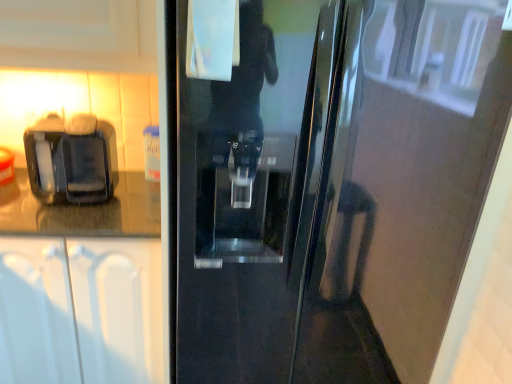
Locate an element on the screen. glossy black refrigerator at center is located at coordinates (329, 186).

Can you see white matte cabinet at left touching glossy black refrigerator at center?

white matte cabinet at left and glossy black refrigerator at center are clearly separated.

Would you say white matte cabinet at left contains glossy black refrigerator at center?

No.

Is white matte cabinet at left shorter than glossy black refrigerator at center?

Correct, white matte cabinet at left is not as tall as glossy black refrigerator at center.

Based on the photo, which is more to the right, white matte cabinet at left or glossy black refrigerator at center?

Positioned to the right is glossy black refrigerator at center.

Does black plastic coffee machine at left come behind white matte cabinet at left?

Yes, it is.

Considering the relative sizes of black plastic coffee machine at left and white matte cabinet at left in the image provided, is black plastic coffee machine at left wider than white matte cabinet at left?

No, black plastic coffee machine at left is not wider than white matte cabinet at left.

How distant is black plastic coffee machine at left from white matte cabinet at left?

black plastic coffee machine at left is 13.58 inches away from white matte cabinet at left.

Does glossy black refrigerator at center contain black plastic coffee machine at left?

No, black plastic coffee machine at left is not surrounded by glossy black refrigerator at center.

Which is in front, glossy black refrigerator at center or black plastic coffee machine at left?

glossy black refrigerator at center is more forward.

Which of these two, glossy black refrigerator at center or black plastic coffee machine at left, stands shorter?

black plastic coffee machine at left is shorter.

Which object is thinner, glossy black refrigerator at center or black plastic coffee machine at left?

black plastic coffee machine at left.

Is glossy black refrigerator at center to the left or to the right of white matte cabinet at left in the image?

Based on their positions, glossy black refrigerator at center is located to the right of white matte cabinet at left.

Between glossy black refrigerator at center and white matte cabinet at left, which one has smaller width?

Thinner between the two is white matte cabinet at left.

Is glossy black refrigerator at center located outside white matte cabinet at left?

Indeed, glossy black refrigerator at center is completely outside white matte cabinet at left.

Who is shorter, white matte cabinet at left or black plastic coffee machine at left?

black plastic coffee machine at left.

Does white matte cabinet at left turn towards black plastic coffee machine at left?

No.

There is a white matte cabinet at left. Identify the location of coffee machine above it (from a real-world perspective). Image resolution: width=512 pixels, height=384 pixels. (72, 160).

Which object is positioned more to the left, black plastic coffee machine at left or glossy black refrigerator at center?

black plastic coffee machine at left.

Considering the relative sizes of black plastic coffee machine at left and glossy black refrigerator at center in the image provided, is black plastic coffee machine at left bigger than glossy black refrigerator at center?

Actually, black plastic coffee machine at left might be smaller than glossy black refrigerator at center.

Is black plastic coffee machine at left directly adjacent to glossy black refrigerator at center?

They are not placed beside each other.

Considering the positions of objects black plastic coffee machine at left and glossy black refrigerator at center in the image provided, who is behind, black plastic coffee machine at left or glossy black refrigerator at center?

black plastic coffee machine at left is further away from the camera.

Locate an element on the screen. door lying in front of the white matte cabinet at left is located at coordinates (329, 186).

Locate an element on the screen. cabinetry beneath the black plastic coffee machine at left (from a real-world perspective) is located at coordinates (x=80, y=310).

When comparing their distances from black plastic coffee machine at left, does glossy black refrigerator at center or white matte cabinet at left seem closer?

Among the two, white matte cabinet at left is located nearer to black plastic coffee machine at left.

Estimate the real-world distances between objects in this image. Which object is closer to glossy black refrigerator at center, white matte cabinet at left or black plastic coffee machine at left?

white matte cabinet at left.

Considering their positions, is white matte cabinet at left positioned closer to black plastic coffee machine at left than glossy black refrigerator at center?

white matte cabinet at left is closer to black plastic coffee machine at left.

Looking at this image, which object lies further to the anchor point white matte cabinet at left, glossy black refrigerator at center or black plastic coffee machine at left?

glossy black refrigerator at center.

From the image, which object appears to be nearer to white matte cabinet at left, black plastic coffee machine at left or glossy black refrigerator at center?

black plastic coffee machine at left is positioned closer to the anchor white matte cabinet at left.

Which object lies further to the anchor point glossy black refrigerator at center, black plastic coffee machine at left or white matte cabinet at left?

black plastic coffee machine at left lies further to glossy black refrigerator at center than the other object.

You are a GUI agent. You are given a task and a screenshot of the screen. Output one action in this format:
    pyautogui.click(x=<x>, y=<y>)
    Task: Click on the coffee machine situated between white matte cabinet at left and glossy black refrigerator at center from left to right
    This screenshot has width=512, height=384.
    Given the screenshot: What is the action you would take?
    pyautogui.click(x=72, y=160)